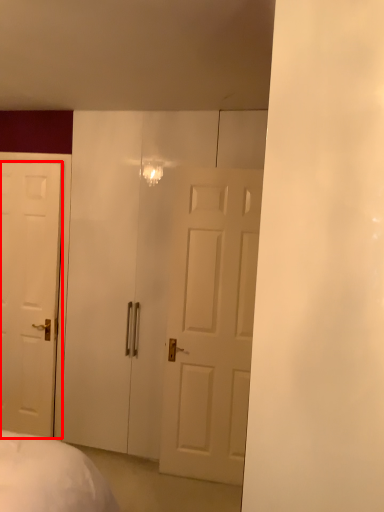
Question: From the image's perspective, what is the correct spatial positioning of door (annotated by the red box) in reference to glass door?

Choices:
 (A) below
 (B) above

Answer: (A)